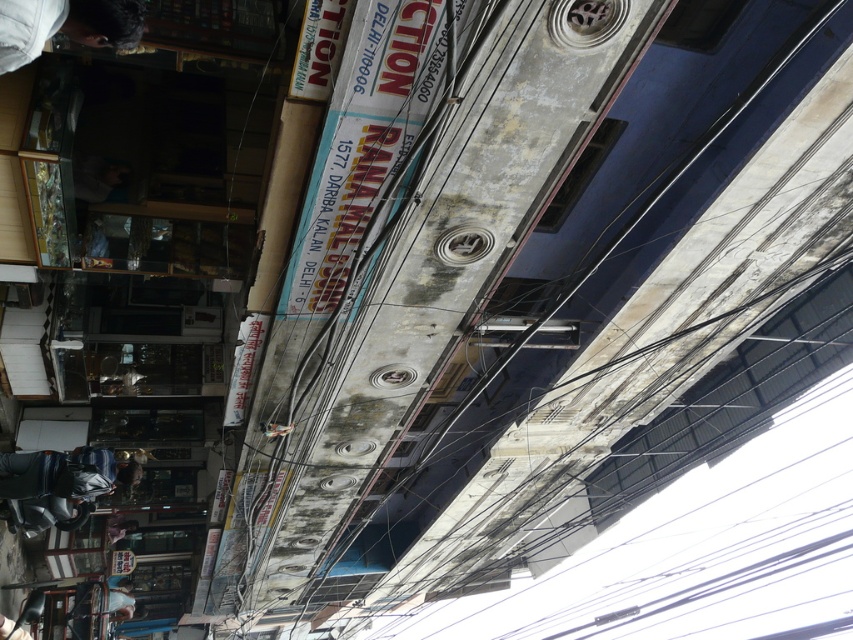
Question: Where is dark hair at upper left located in relation to metallic helmet at lower left in the image?

Choices:
 (A) below
 (B) above

Answer: (B)

Question: Is dark hair at upper left behind metallic helmet at lower left?

Choices:
 (A) no
 (B) yes

Answer: (A)

Question: Can you confirm if dark hair at upper left is positioned to the right of metallic helmet at lower left?

Choices:
 (A) yes
 (B) no

Answer: (A)

Question: Which point is farther from the camera taking this photo?

Choices:
 (A) (49, 467)
 (B) (78, 6)

Answer: (A)

Question: Which object appears closest to the camera in this image?

Choices:
 (A) dark hair at upper left
 (B) metallic helmet at lower left

Answer: (A)

Question: Which point is farther to the camera?

Choices:
 (A) (131, 456)
 (B) (57, 1)

Answer: (A)